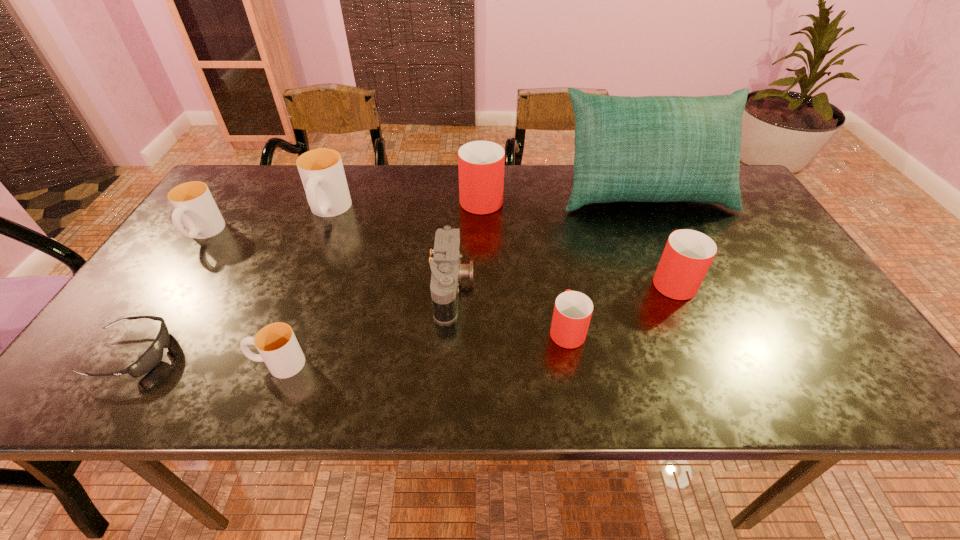
This screenshot has width=960, height=540. Find the location of `unoccupied area between the third object from right to left and the shortest object`. unoccupied area between the third object from right to left and the shortest object is located at coordinates (349, 342).

You are a GUI agent. You are given a task and a screenshot of the screen. Output one action in this format:
    pyautogui.click(x=<x>, y=<y>)
    Task: Click on the closest object to the biggest yellow cup
    The image size is (960, 540).
    Given the screenshot: What is the action you would take?
    pyautogui.click(x=194, y=205)

Locate which object ranks third in proximity to the leftmost yellow cup. Please provide its 2D coordinates. Your answer should be formatted as a tuple, i.e. [(x, y)], where the tuple contains the x and y coordinates of a point satisfying the conditions above.

[(278, 347)]

The image size is (960, 540). I want to click on cup that stands as the second closest to the second red cup from left to right, so click(x=481, y=164).

Select which cup appears as the closest to the cushion. Please provide its 2D coordinates. Your answer should be formatted as a tuple, i.e. [(x, y)], where the tuple contains the x and y coordinates of a point satisfying the conditions above.

[(688, 254)]

Locate an element on the screen. the second closest red cup to the second smallest red cup is located at coordinates (481, 164).

You are a GUI agent. You are given a task and a screenshot of the screen. Output one action in this format:
    pyautogui.click(x=<x>, y=<y>)
    Task: Click on the red cup that is the closest to the rightmost red cup
    The height and width of the screenshot is (540, 960).
    Given the screenshot: What is the action you would take?
    pyautogui.click(x=572, y=313)

Choose which yellow cup is the third nearest neighbor to the goggles. Please provide its 2D coordinates. Your answer should be formatted as a tuple, i.e. [(x, y)], where the tuple contains the x and y coordinates of a point satisfying the conditions above.

[(321, 170)]

Select which yellow cup appears as the second closest to the camera. Please provide its 2D coordinates. Your answer should be formatted as a tuple, i.e. [(x, y)], where the tuple contains the x and y coordinates of a point satisfying the conditions above.

[(321, 170)]

The height and width of the screenshot is (540, 960). What are the coordinates of `vacant area that satisfies the following two spatial constraints: 1. with the handle on the side of the smallest yellow cup; 2. on the side of the second biggest red cup with the handle` in the screenshot? It's located at (311, 279).